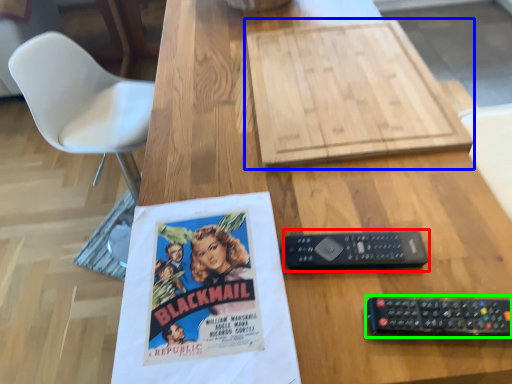
Question: Estimate the real-world distances between objects in this image. Which object is farther from control (highlighted by a red box), cardboard (highlighted by a blue box) or remote control (highlighted by a green box)?

Choices:
 (A) cardboard
 (B) remote control

Answer: (A)